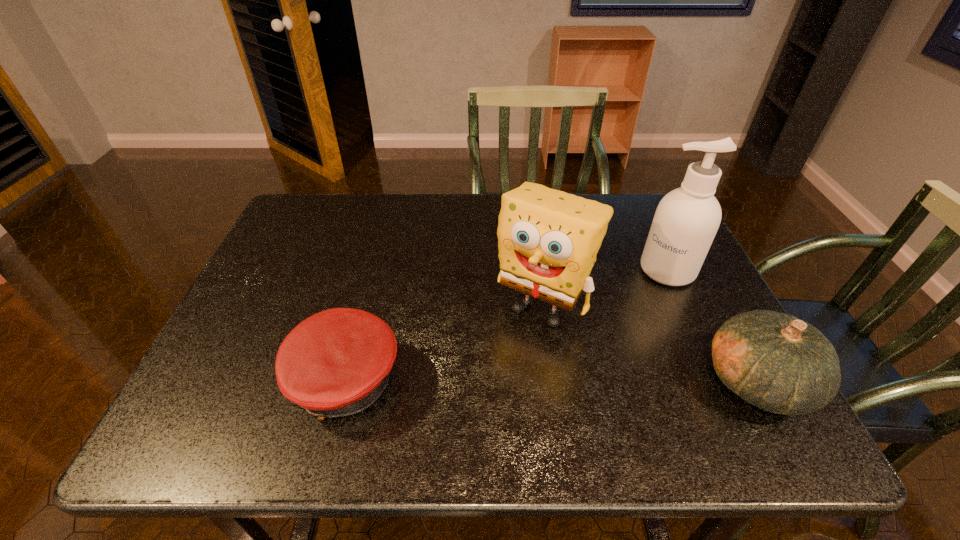
I want to click on free space located on the front label of the cleansing agent, so click(577, 361).

The width and height of the screenshot is (960, 540). I want to click on vacant space located on the front label of the cleansing agent, so click(x=603, y=335).

Find the location of a particular element. free region located 0.380m on the front label of the cleansing agent is located at coordinates (566, 372).

You are a GUI agent. You are given a task and a screenshot of the screen. Output one action in this format:
    pyautogui.click(x=<x>, y=<y>)
    Task: Click on the free space located 0.110m on the face of the sponge
    This screenshot has width=960, height=540.
    Given the screenshot: What is the action you would take?
    pyautogui.click(x=499, y=367)

You are a GUI agent. You are given a task and a screenshot of the screen. Output one action in this format:
    pyautogui.click(x=<x>, y=<y>)
    Task: Click on the blank space located on the face of the sponge
    
    Given the screenshot: What is the action you would take?
    pyautogui.click(x=478, y=399)

Where is `vacant space positioned 0.050m on the face of the sponge`? The height and width of the screenshot is (540, 960). vacant space positioned 0.050m on the face of the sponge is located at coordinates (512, 347).

Find the location of a particular element. This screenshot has width=960, height=540. cap located in the near edge section of the desktop is located at coordinates (337, 362).

Find the location of a particular element. The image size is (960, 540). gourd located in the near edge section of the desktop is located at coordinates (781, 364).

Where is `gourd present at the right edge`? gourd present at the right edge is located at coordinates (781, 364).

Where is `cleansing agent located in the right edge section of the desktop`? The width and height of the screenshot is (960, 540). cleansing agent located in the right edge section of the desktop is located at coordinates (686, 220).